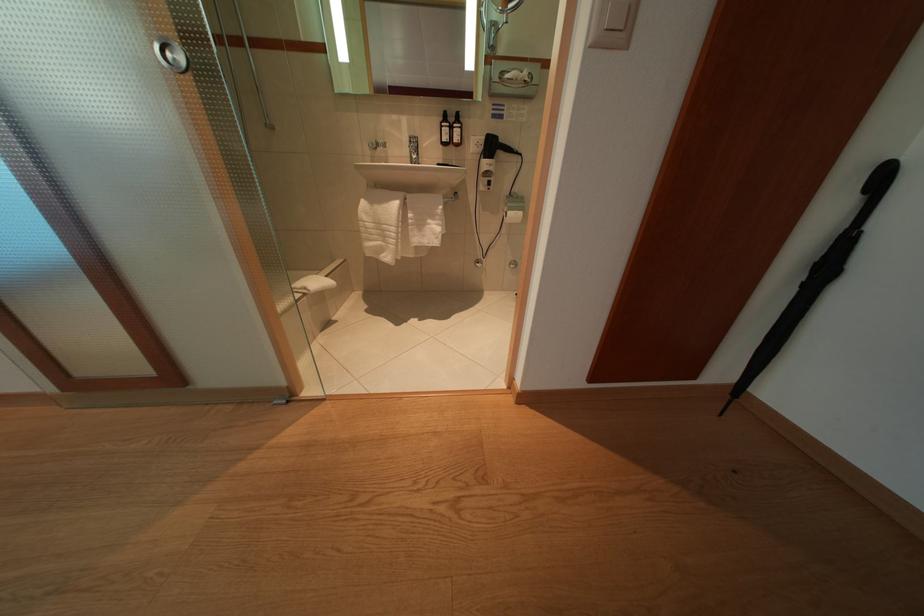
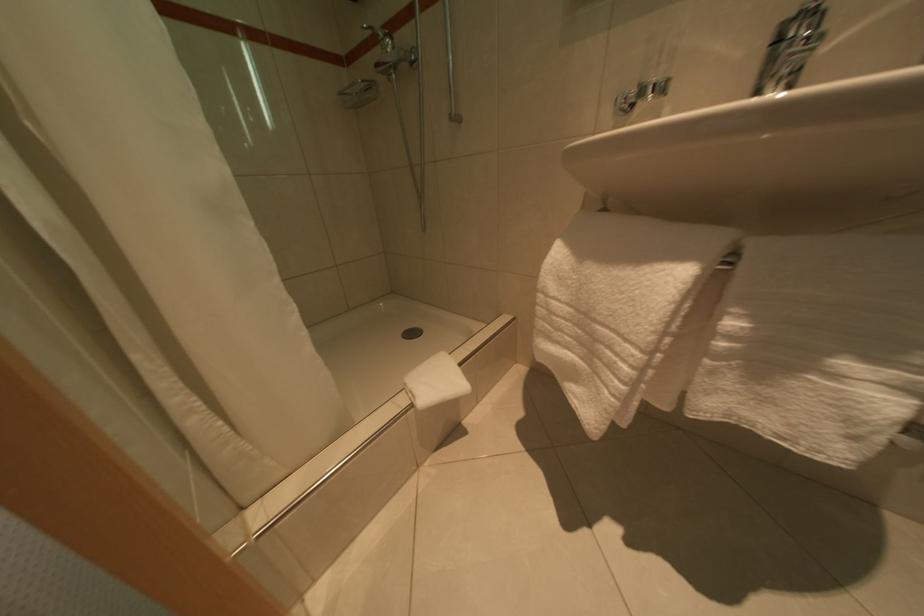
Question: The camera is either moving clockwise (left) or counter-clockwise (right) around the object. The first image is from the beginning of the video and the second image is from the end. Is the camera moving left or right when shooting the video?

Choices:
 (A) Left
 (B) Right

Answer: (B)